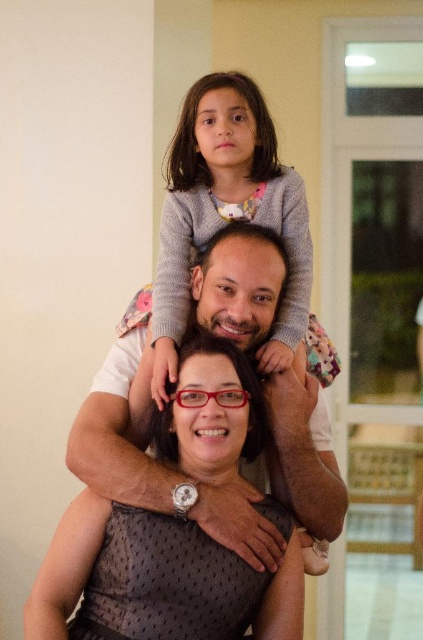
Which is below, matte black dress at center or matte white shirt at center?

matte black dress at center

Between matte black dress at center and matte white shirt at center, which one has less height?

matte black dress at center

Locate an element on the screen. Image resolution: width=423 pixels, height=640 pixels. matte black dress at center is located at coordinates coord(158,580).

Is matte white shirt at center behind gray sweater at upper center?

No.

Can you confirm if matte white shirt at center is positioned above gray sweater at upper center?

Actually, matte white shirt at center is below gray sweater at upper center.

Does point (291, 440) lie behind point (260, 184)?

That is False.

Locate an element on the screen. matte white shirt at center is located at coordinates (279, 480).

Who is positioned more to the right, matte black dress at center or gray sweater at upper center?

Positioned to the right is gray sweater at upper center.

Describe the element at coordinates (158, 580) in the screenshot. I see `matte black dress at center` at that location.

The width and height of the screenshot is (423, 640). Identify the location of matte black dress at center. (158, 580).